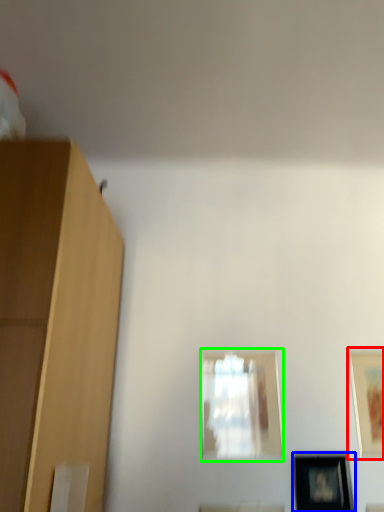
Question: Which object is positioned closest to picture frame (highlighted by a red box)? Select from picture frame (highlighted by a blue box) and picture frame (highlighted by a green box).

Choices:
 (A) picture frame
 (B) picture frame

Answer: (A)